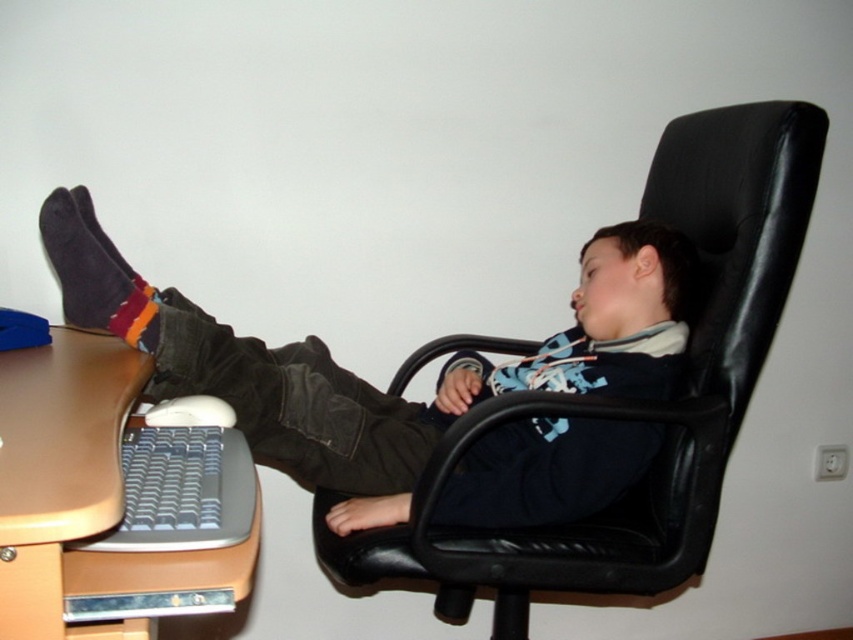
You are designing a layout for a home office and need to place a new desk lamp. The lamp requires a space of at least 0.5 units in width. Given the coordinates provided, can the lamp be placed at point (633, 401) on the black leather swivel chair at center?

The point (633, 401) is on the black leather swivel chair at center, so placing the desk lamp there is not suitable because the chair is an object and cannot hold the lamp.

What are the coordinates of the dark blue sweater at center?

The dark blue sweater at center is located at point (360, 378).

You are organizing a small party in the office and need to move the black leather swivel chair at center to make space. Which direction should you move it to avoid stepping on the dark gray suede socks at lower left?

The black leather swivel chair at center is positioned on the right side of dark gray suede socks at lower left, so moving it to the right would avoid stepping on the socks.